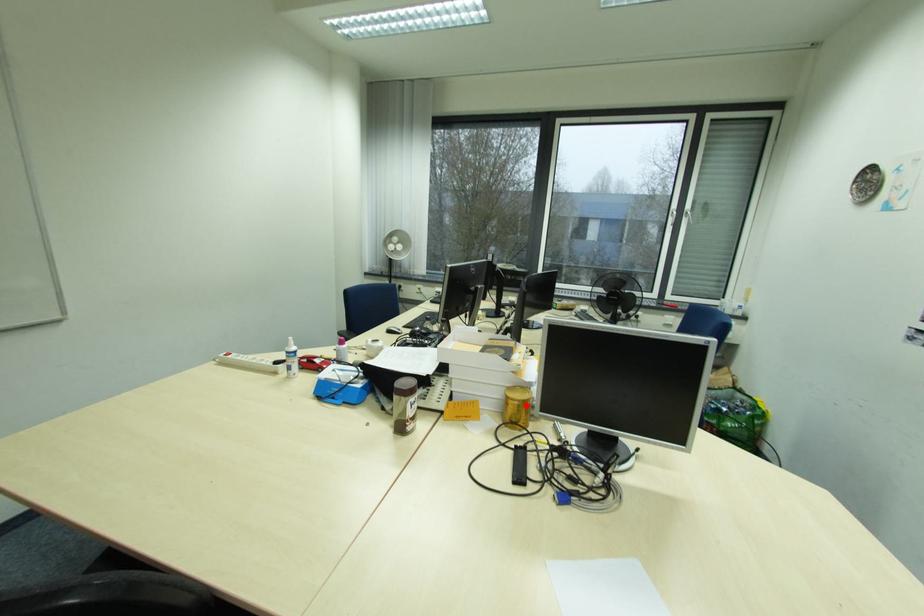
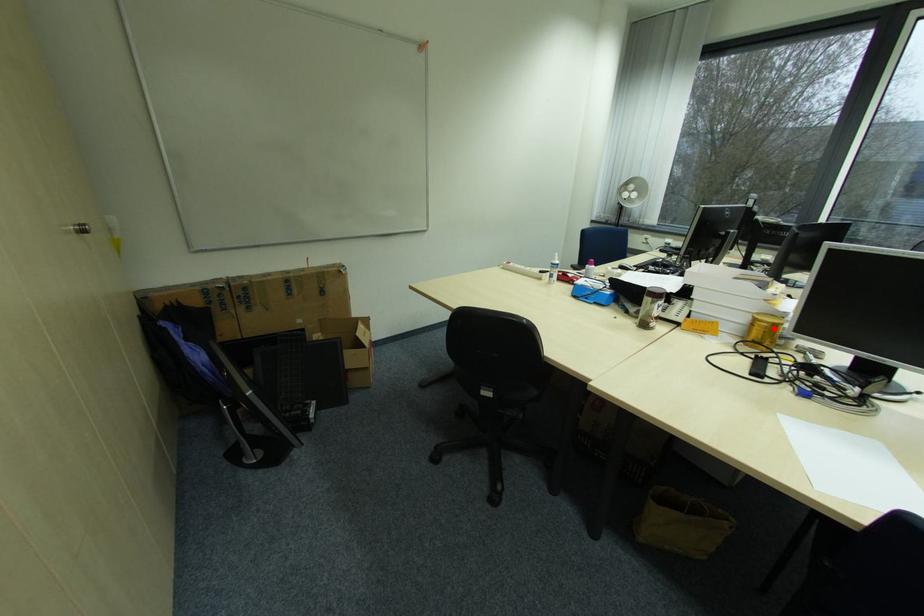
Consider the image. I am providing you with two images of the same scene from different viewpoints. A red point is marked on the first image and another point is marked on the second image. Are the points marked in image1 and image2 representing the same 3D position?

Yes